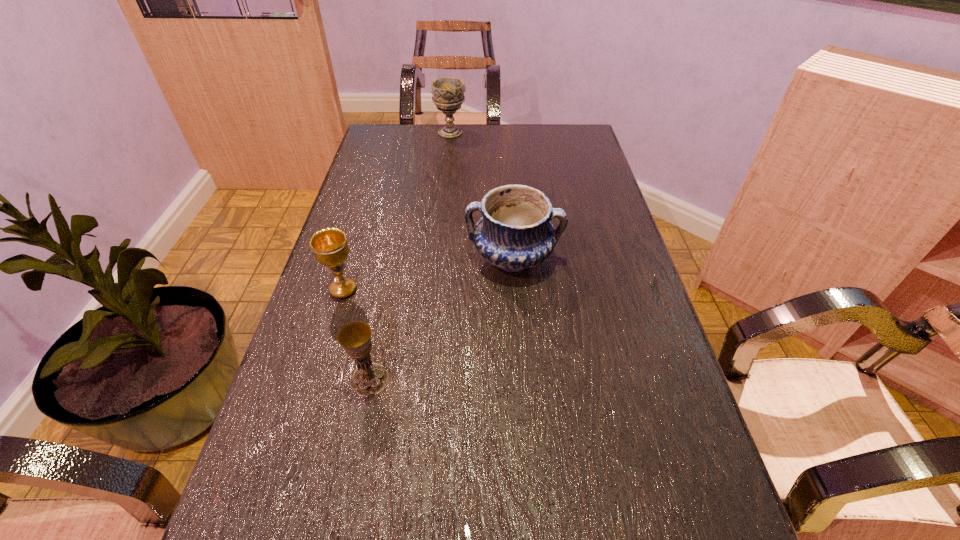
What are the coordinates of `vacant space located on the back of the nearest chalice` in the screenshot? It's located at (386, 297).

I want to click on object located at the far edge, so click(448, 92).

In the image, there is a desktop. Where is `vacant space at the far edge`? This screenshot has width=960, height=540. vacant space at the far edge is located at coordinates (489, 156).

Where is `free space at the right edge of the desktop`? The width and height of the screenshot is (960, 540). free space at the right edge of the desktop is located at coordinates (584, 160).

Locate an element on the screen. This screenshot has height=540, width=960. vacant region at the far left corner of the desktop is located at coordinates (396, 132).

In order to click on vacant area between the rightmost object and the farthest chalice in this screenshot , I will do `click(482, 195)`.

I want to click on empty space that is in between the rightmost object and the leftmost object, so click(x=428, y=274).

Locate an element on the screen. The image size is (960, 540). empty location between the nearest chalice and the farthest object is located at coordinates (410, 256).

Image resolution: width=960 pixels, height=540 pixels. I want to click on empty space between the nearest object and the pottery, so click(x=442, y=319).

Where is `vacant space that's between the farthest chalice and the leftmost chalice`? Image resolution: width=960 pixels, height=540 pixels. vacant space that's between the farthest chalice and the leftmost chalice is located at coordinates (396, 211).